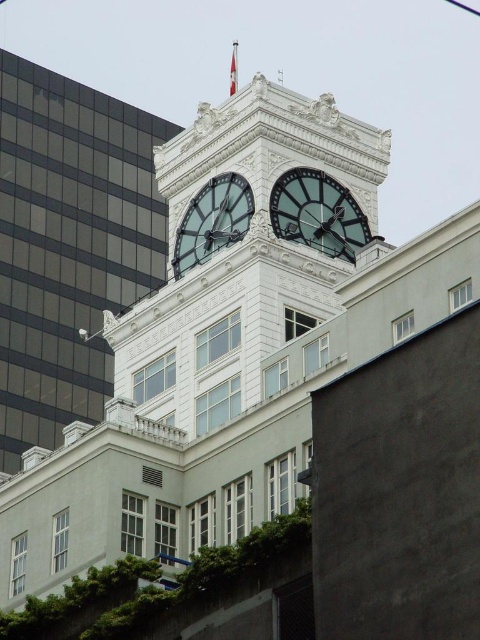
Can you confirm if white marble clock tower at upper center is positioned below polished brass clock at upper center?

Indeed, white marble clock tower at upper center is positioned under polished brass clock at upper center.

Is white marble clock tower at upper center thinner than polished brass clock at upper center?

Incorrect, white marble clock tower at upper center's width is not less than polished brass clock at upper center's.

Measure the distance between white marble clock tower at upper center and camera.

white marble clock tower at upper center is 62.39 meters from camera.

Locate an element on the screen. The width and height of the screenshot is (480, 640). white marble clock tower at upper center is located at coordinates (204, 362).

Does polished brass clock at upper center appear on the left side of matte glass clock at upper center?

In fact, polished brass clock at upper center is to the right of matte glass clock at upper center.

The height and width of the screenshot is (640, 480). Find the location of `polished brass clock at upper center`. polished brass clock at upper center is located at coordinates (317, 212).

What are the coordinates of `polished brass clock at upper center` in the screenshot? It's located at (317, 212).

Who is more distant from viewer, (327, 136) or (187, 236)?

The point (327, 136) is behind.

Is white marble clock tower at upper center bigger than matte glass clock at upper center?

Yes, white marble clock tower at upper center is bigger than matte glass clock at upper center.

In the scene shown: Measure the distance between point (251, 134) and camera.

The distance of point (251, 134) from camera is 247.64 feet.

The image size is (480, 640). In order to click on white marble clock tower at upper center in this screenshot , I will do `click(204, 362)`.